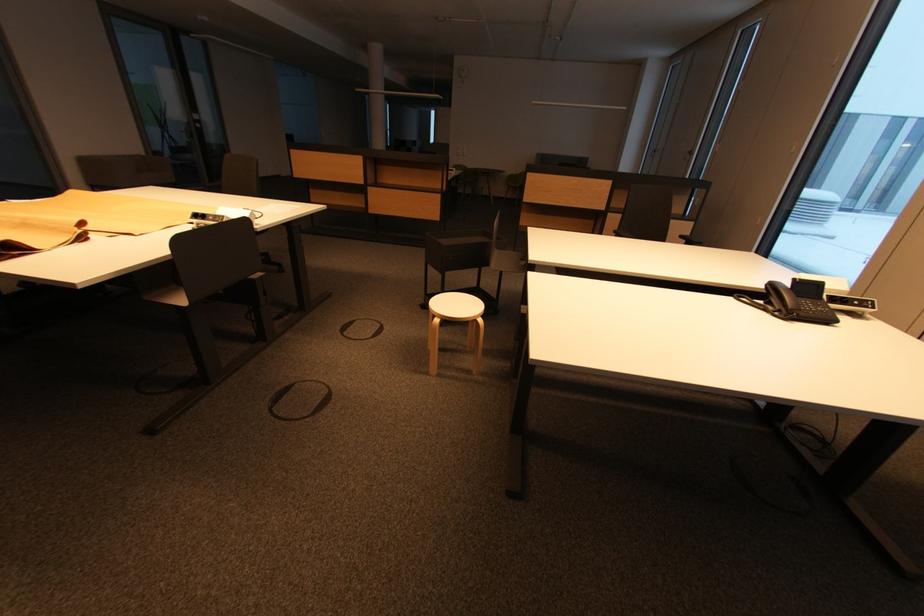
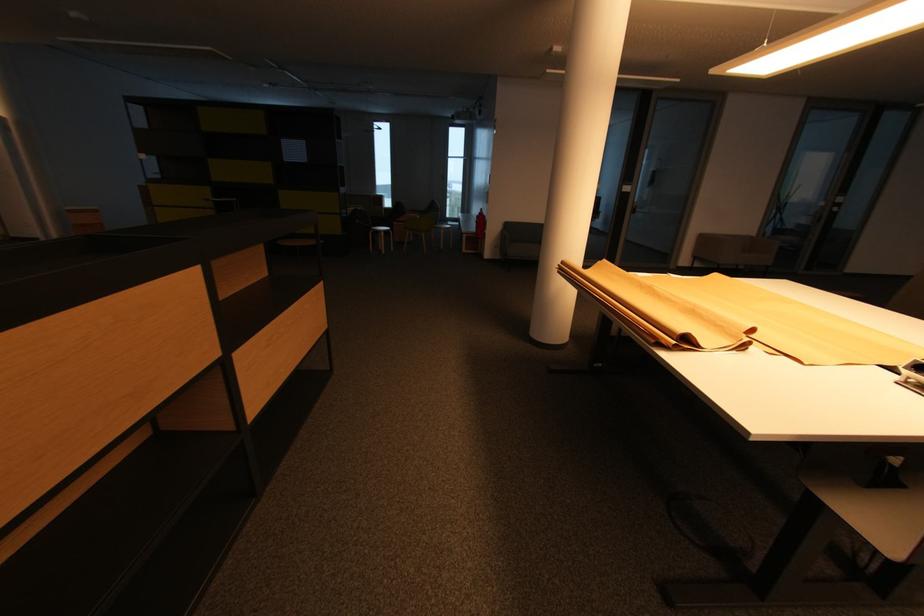
Question: The images are taken continuously from a first-person perspective. In which direction is your viewpoint rotating?

Choices:
 (A) Left
 (B) Right
 (C) Up
 (D) Down

Answer: (A)